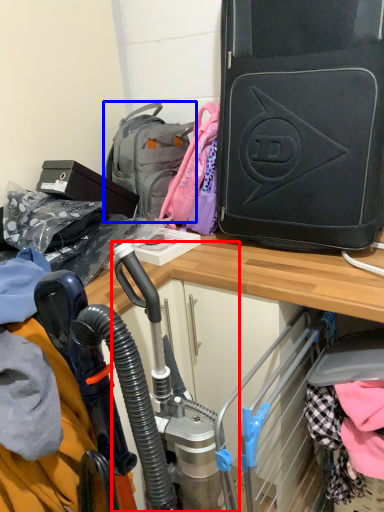
Question: Which point is further to the camera, sport equipment (highlighted by a red box) or backpack (highlighted by a blue box)?

Choices:
 (A) sport equipment
 (B) backpack

Answer: (B)